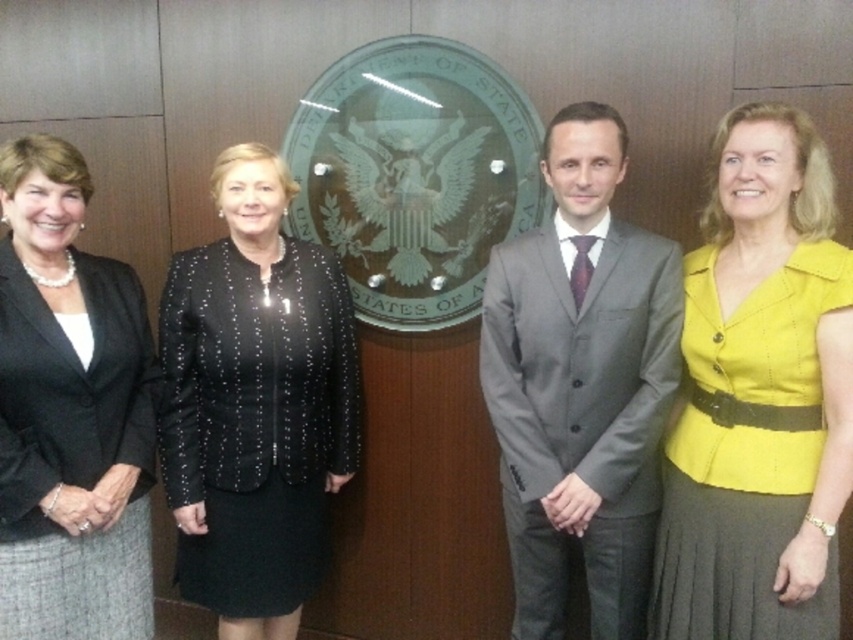
Does black textured blazer at center appear under matte black blazer at left?

Yes, black textured blazer at center is below matte black blazer at left.

Is black textured blazer at center bigger than matte black blazer at left?

Yes.

Does point (314, 308) come behind point (77, 561)?

That is True.

Locate an element on the screen. The image size is (853, 640). black textured blazer at center is located at coordinates (254, 403).

Does gray suit at center have a larger size compared to black textured blazer at center?

No.

Does gray suit at center have a greater width compared to black textured blazer at center?

In fact, gray suit at center might be narrower than black textured blazer at center.

Locate an element on the screen. gray suit at center is located at coordinates (581, 385).

Can you confirm if yellow fabric dress at right is positioned above matte black blazer at left?

Indeed, yellow fabric dress at right is positioned over matte black blazer at left.

Where is `yellow fabric dress at right`? The height and width of the screenshot is (640, 853). yellow fabric dress at right is located at coordinates (759, 396).